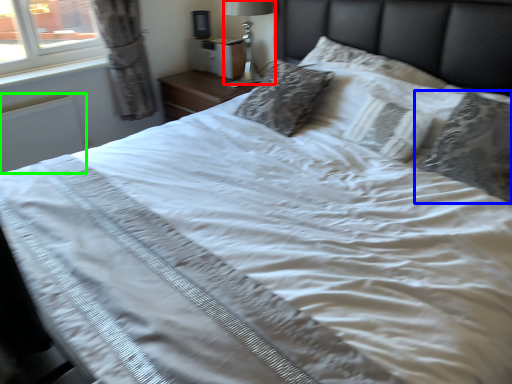
Question: Which object is positioned farthest from bedside lamp (highlighted by a red box)? Select from pillow (highlighted by a blue box) and radiator (highlighted by a green box).

Choices:
 (A) pillow
 (B) radiator

Answer: (A)